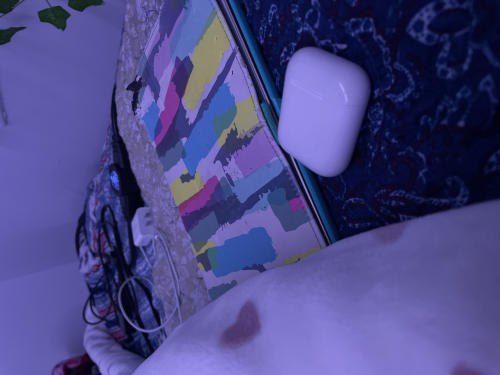
At what (x,y) coordinates should I click in order to perform the action: click on grey wall. Please return your answer as a coordinate pair (x, y). Looking at the image, I should click on (39, 128).